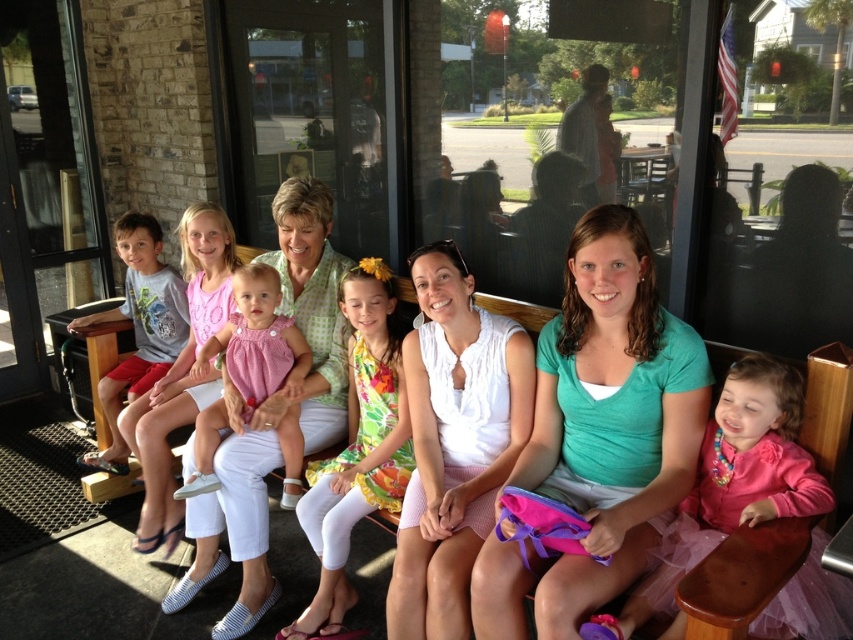
Does floral dress at center appear on the left side of pink fabric dress at center?

Incorrect, floral dress at center is not on the left side of pink fabric dress at center.

Can you confirm if floral dress at center is smaller than pink fabric dress at center?

Incorrect, floral dress at center is not smaller in size than pink fabric dress at center.

Identify the location of floral dress at center. Image resolution: width=853 pixels, height=640 pixels. (357, 445).

You are a GUI agent. You are given a task and a screenshot of the screen. Output one action in this format:
    pyautogui.click(x=<x>, y=<y>)
    Task: Click on the white cotton blouse at center
    The width and height of the screenshot is (853, 640).
    Given the screenshot: What is the action you would take?
    (454, 442)

Can you confirm if white cotton blouse at center is thinner than pink satin dress at left?

No, white cotton blouse at center is not thinner than pink satin dress at left.

Which is behind, point (424, 456) or point (180, 240)?

Positioned behind is point (180, 240).

Identify the location of white cotton blouse at center. (454, 442).

Is white cotton blouse at center behind knitted pink dress at center?

No, it is not.

What do you see at coordinates (454, 442) in the screenshot? The image size is (853, 640). I see `white cotton blouse at center` at bounding box center [454, 442].

Identify the location of white cotton blouse at center. (454, 442).